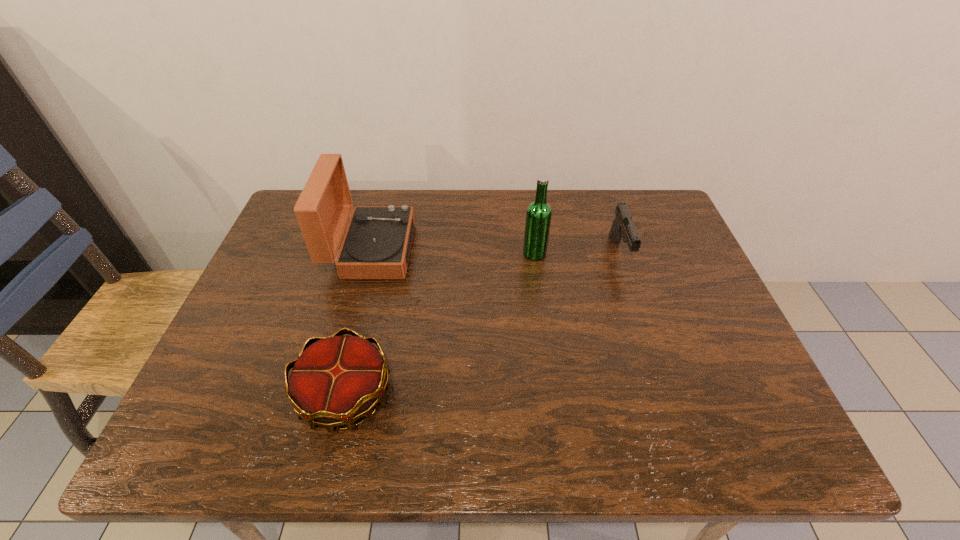
At what (x,y) coordinates should I click in order to perform the action: click on the third object from left to right. Please return your answer as a coordinate pair (x, y). This screenshot has width=960, height=540. Looking at the image, I should click on (538, 216).

Where is `phonograph record`? The width and height of the screenshot is (960, 540). phonograph record is located at coordinates [x=376, y=245].

The width and height of the screenshot is (960, 540). Find the location of `the rightmost object`. the rightmost object is located at coordinates (623, 227).

Find the location of a particular element. The width and height of the screenshot is (960, 540). the nearest object is located at coordinates [x=335, y=380].

Where is `crown`? The image size is (960, 540). crown is located at coordinates (335, 380).

This screenshot has width=960, height=540. I want to click on vacant point located 0.190m on the back of the beer bottle, so click(528, 206).

The width and height of the screenshot is (960, 540). I want to click on free space located on the face of the phonograph record, so click(551, 251).

Find the location of a particular element. This screenshot has width=960, height=540. vacant space situated aim along the barrel of the rightmost object is located at coordinates (653, 351).

Find the location of a particular element. This screenshot has width=960, height=540. vacant space located 0.060m on the right of the nearest object is located at coordinates (422, 395).

Where is `phonograph record located in the far edge section of the desktop`? Image resolution: width=960 pixels, height=540 pixels. phonograph record located in the far edge section of the desktop is located at coordinates (376, 245).